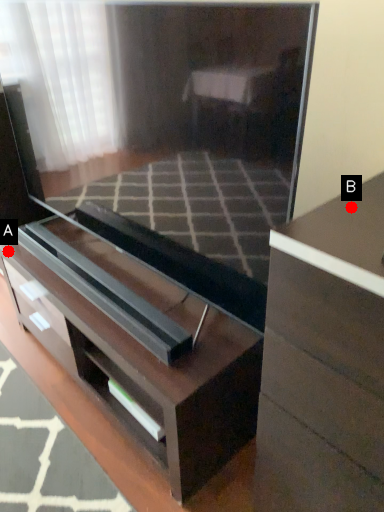
Question: Two points are circled on the image, labeled by A and B beside each circle. Which point appears farthest from the camera in this image?

Choices:
 (A) A is further
 (B) B is further

Answer: (A)